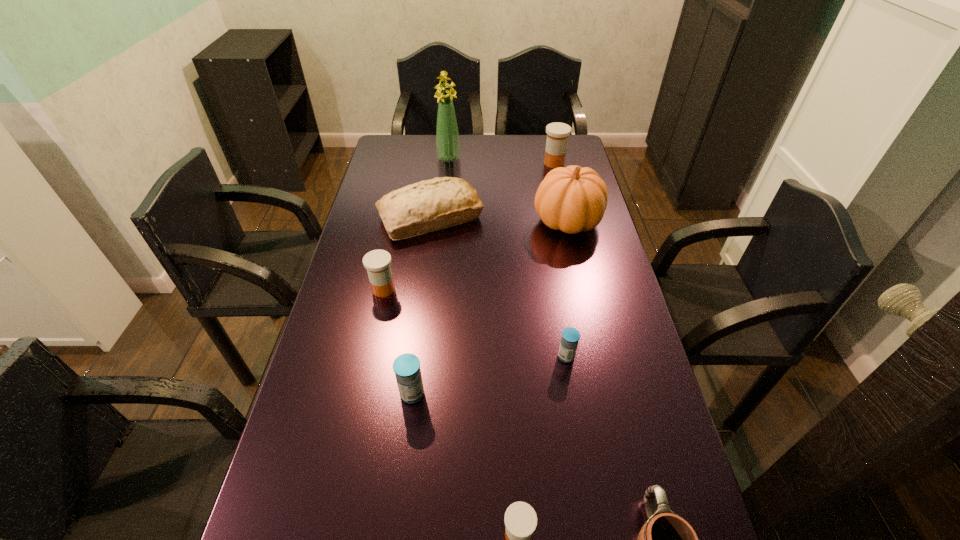
Where is `the tallest object`? This screenshot has height=540, width=960. the tallest object is located at coordinates (447, 135).

Where is `green bouquet`? This screenshot has width=960, height=540. green bouquet is located at coordinates tap(447, 135).

Identify the location of pumpkin. The width and height of the screenshot is (960, 540). (572, 199).

Where is `orange pumpkin`? The image size is (960, 540). orange pumpkin is located at coordinates (572, 199).

I want to click on the farthest medicine, so click(x=557, y=133).

Identify the location of the farthest orange medicine. [x=557, y=133].

Where is `bread`? The image size is (960, 540). bread is located at coordinates (429, 205).

You are a GUI agent. You are given a task and a screenshot of the screen. Output one action in this format:
    pyautogui.click(x=<x>, y=<y>)
    Task: Click on the second smallest orange medicine
    
    Given the screenshot: What is the action you would take?
    pyautogui.click(x=377, y=262)

Image resolution: width=960 pixels, height=540 pixels. I want to click on the second nearest orange medicine, so click(377, 262).

Identify the location of the nearer blue medicine. The height and width of the screenshot is (540, 960). point(407,370).